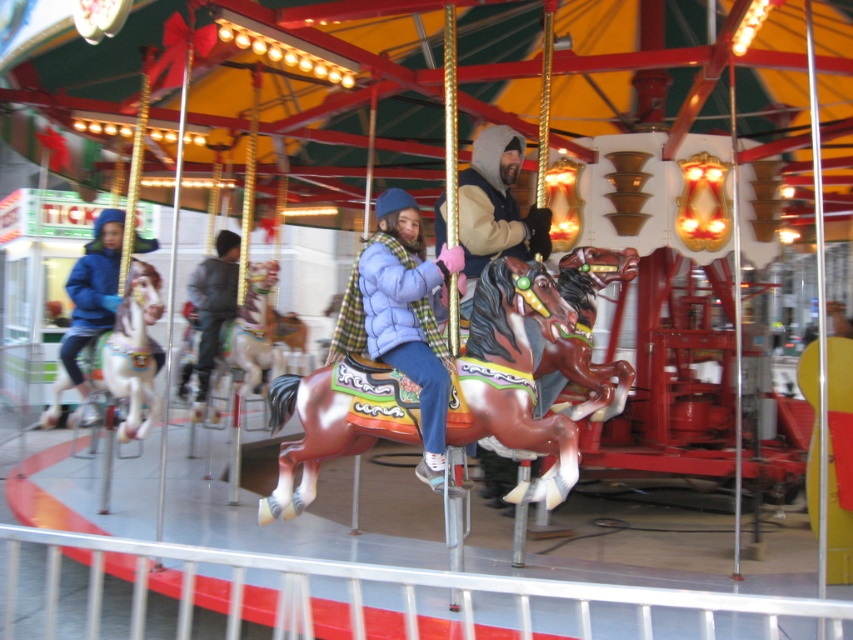
You are standing at the camera position and want to take a photo of the painted wood horse at center. The camera has a maximum focus range of 4 meters. Will the horse be in focus?

The painted wood horse at center and camera are 3.92 meters apart, so the horse will be within the camera focus range of 4 meters and thus in focus.

Based on the photo, you are a parent standing at the entrance of the carousel. Your child is sitting on the white glossy horse at left and you are wearing the gray fabric jacket at center. Can you reach out and touch your child while staying in your current positions?

The white glossy horse at left is 1.70 meters away from the gray fabric jacket at center. Since the distance is 1.70 meters, it might be difficult to reach out and touch your child from that distance while staying in your current positions.